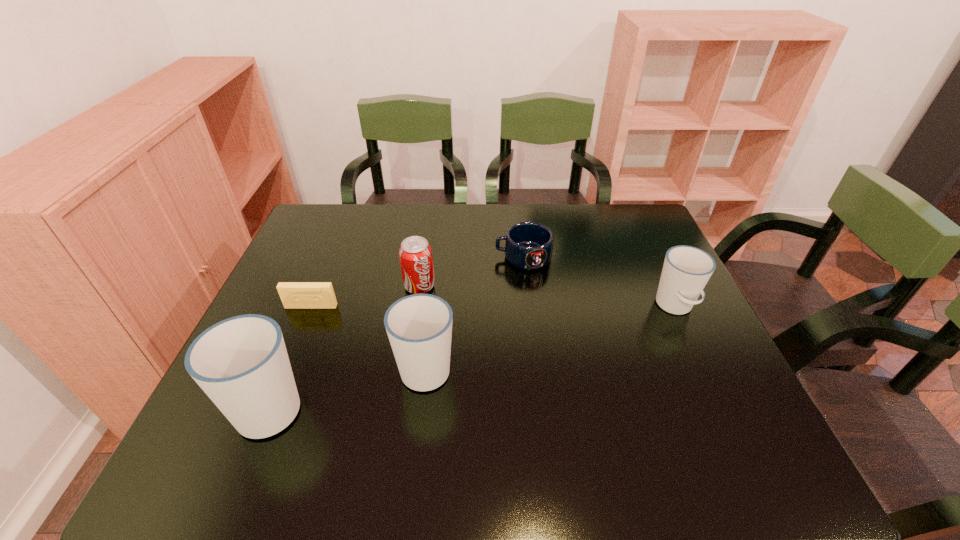
Image resolution: width=960 pixels, height=540 pixels. I want to click on vacant point located 0.250m with a handle on the side of the leftmost cup, so click(317, 295).

Where is `free space located with a handle on the side of the leftmost cup`? free space located with a handle on the side of the leftmost cup is located at coordinates (300, 336).

Identify the location of vacant space located 0.370m with a handle on the side of the second shortest cup. Image resolution: width=960 pixels, height=540 pixels. (440, 248).

This screenshot has width=960, height=540. I want to click on vacant space located 0.160m with a handle on the side of the second shortest cup, so click(x=434, y=295).

What are the coordinates of `vacant position located 0.120m with a handle on the side of the second shortest cup` in the screenshot? It's located at (433, 306).

I want to click on free location located 0.060m with a handle on the side of the shortest cup, so click(692, 343).

Where is `free space located 0.130m at the front of the videotape with spools`? The height and width of the screenshot is (540, 960). free space located 0.130m at the front of the videotape with spools is located at coordinates (294, 348).

Locate an element on the screen. This screenshot has height=540, width=960. vacant region located 0.150m with the handle on the side of the farthest object is located at coordinates (445, 256).

Locate an element on the screen. The width and height of the screenshot is (960, 540). free spot located with the handle on the side of the farthest object is located at coordinates (398, 256).

This screenshot has width=960, height=540. What are the coordinates of `vacant region located 0.120m with the handle on the side of the farthest object` in the screenshot? It's located at (455, 256).